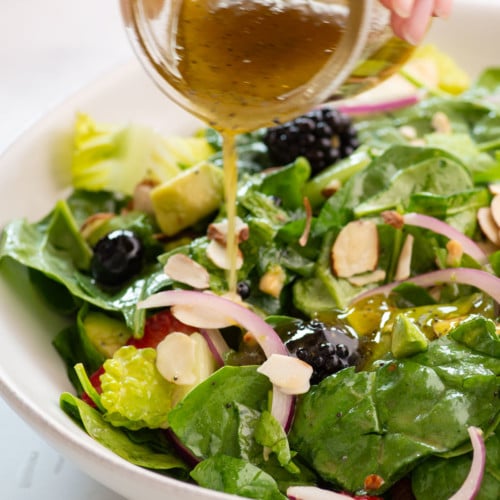
Identify the location of white plate. This screenshot has width=500, height=500. (20, 405).